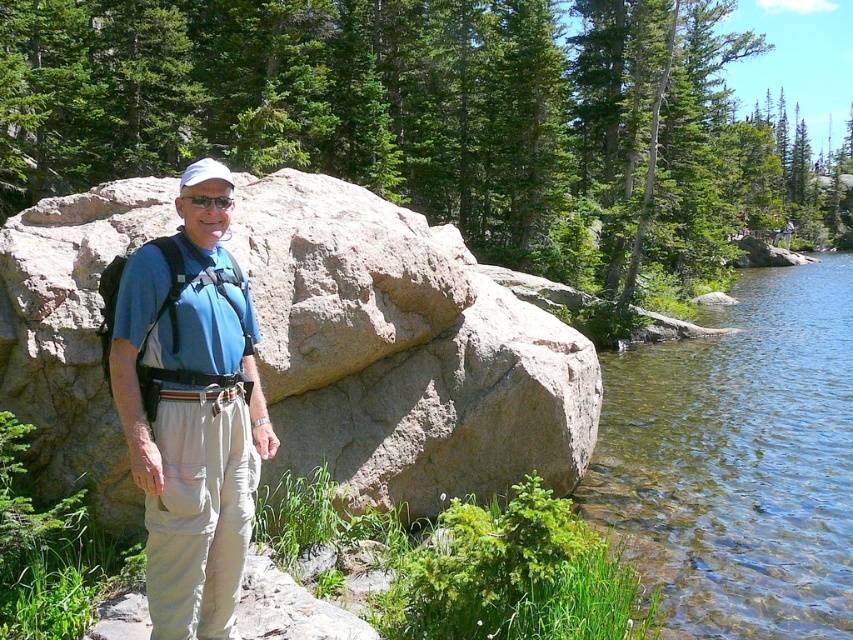
Is clear water at lower right shorter than blue fabric shirt at center?

No, clear water at lower right is not shorter than blue fabric shirt at center.

Which of these two, clear water at lower right or blue fabric shirt at center, stands taller?

With more height is clear water at lower right.

Who is more forward, (698, 483) or (264, 454)?

Point (264, 454) is more forward.

Find the location of a particular element. This screenshot has width=853, height=640. clear water at lower right is located at coordinates (740, 460).

Does brown rough rock at center appear on the right side of blue fabric shirt at center?

Yes, brown rough rock at center is to the right of blue fabric shirt at center.

Is brown rough rock at center thinner than blue fabric shirt at center?

No.

Describe the element at coordinates (403, 352) in the screenshot. I see `brown rough rock at center` at that location.

In order to click on brown rough rock at center in this screenshot , I will do `click(403, 352)`.

Which is above, brown rough rock at center or matte black goggles at center?

matte black goggles at center

Is point (314, 224) behind point (184, 198)?

Yes, point (314, 224) is behind point (184, 198).

Where is `brown rough rock at center`? Image resolution: width=853 pixels, height=640 pixels. brown rough rock at center is located at coordinates (403, 352).